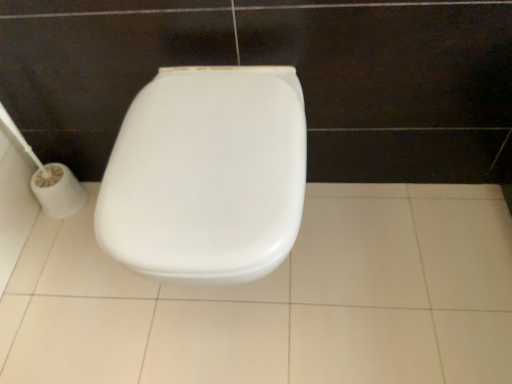
Where is `vacant region above white plastic toilet at center (from a real-world perspective)`? The height and width of the screenshot is (384, 512). vacant region above white plastic toilet at center (from a real-world perspective) is located at coordinates (207, 144).